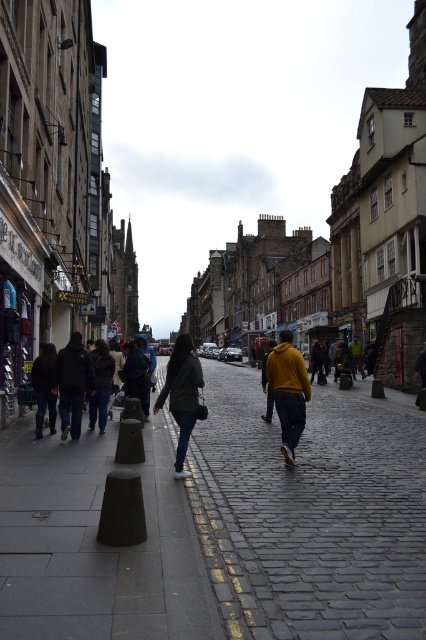
You are a pedestrian on the cobblestone street and see both the dark gray jacket at center and the yellow matte jacket at center. Which jacket is closer to the ground?

The dark gray jacket at center is closer to the ground because it is positioned under the yellow matte jacket at center.

You are a delivery person standing on the gray cobblestone pavement at center and need to place a package on the matte yellow hoodie at center. Is the pavement under the hoodie wide enough to accommodate the package?

The gray cobblestone pavement at center is positioned under matte yellow hoodie at center, so the package can be placed there as the pavement is directly underneath the hoodie.